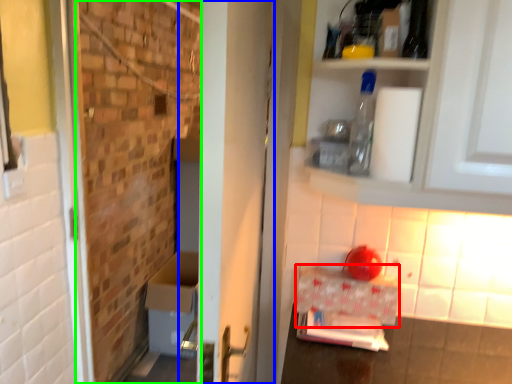
Question: Which object is the farthest from cardboard box (highlighted by a red box)? Choose among these: door (highlighted by a blue box) or brickwork (highlighted by a green box).

Choices:
 (A) door
 (B) brickwork

Answer: (B)